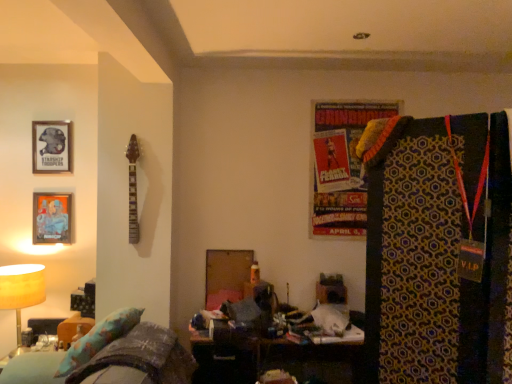
Question: From the image's perspective, is matte yellow lampshade at left located above or below metallic silver picture frame at upper left, positioned as the 1th picture frame in top-to-bottom order?

Choices:
 (A) above
 (B) below

Answer: (B)

Question: Considering the relative positions of matte yellow lampshade at left and metallic silver picture frame at upper left, which appears as the 2th picture frame when ordered from the bottom, in the image provided, is matte yellow lampshade at left to the left or to the right of metallic silver picture frame at upper left, which appears as the 2th picture frame when ordered from the bottom,?

Choices:
 (A) right
 (B) left

Answer: (B)

Question: Which object is the closest to the metallic silver picture frame at left, which is the second picture frame from top to bottom?

Choices:
 (A) metallic silver picture frame at upper left, which appears as the 2th picture frame when ordered from the bottom
 (B) fluffy fabric couch at lower left
 (C) matte yellow lampshade at left

Answer: (A)

Question: Estimate the real-world distances between objects in this image. Which object is farther from the matte yellow lampshade at left?

Choices:
 (A) metallic silver picture frame at left, which is the second picture frame from top to bottom
 (B) metallic silver picture frame at upper left, positioned as the 1th picture frame in top-to-bottom order
 (C) fluffy fabric couch at lower left

Answer: (B)